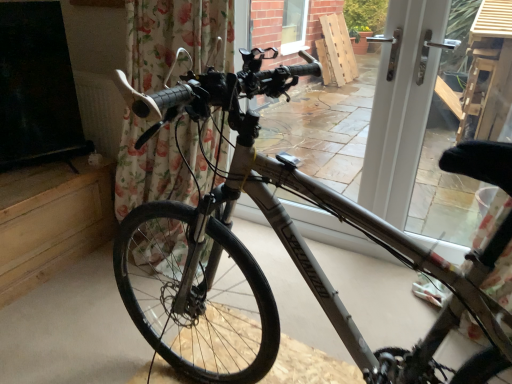
Identify the location of free space in front of floral fabric curtain at left. The width and height of the screenshot is (512, 384). (99, 303).